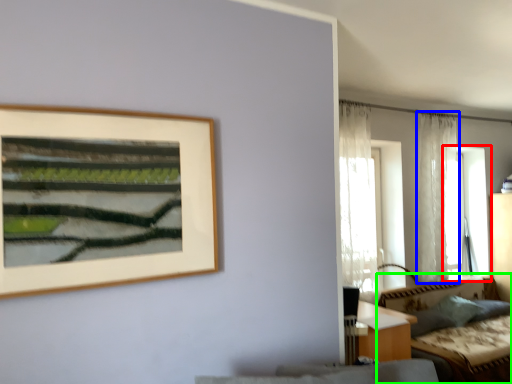
Question: Which object is positioned farthest from window (highlighted by a red box)? Select from curtain (highlighted by a blue box) and couch (highlighted by a green box).

Choices:
 (A) curtain
 (B) couch

Answer: (B)